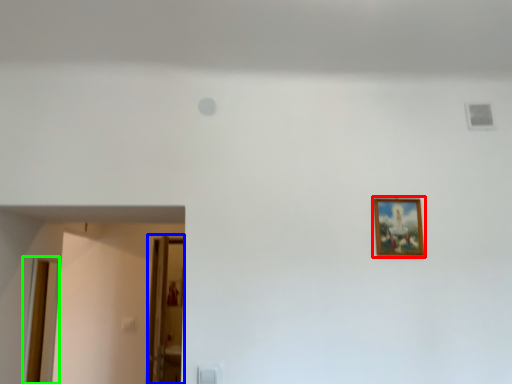
Question: Estimate the real-world distances between objects in this image. Which object is farther from picture frame (highlighted by a red box), glass door (highlighted by a blue box) or door (highlighted by a green box)?

Choices:
 (A) glass door
 (B) door

Answer: (B)